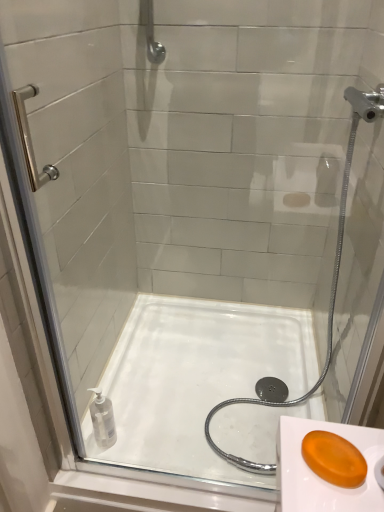
What do you see at coordinates (153, 39) in the screenshot?
I see `brushed metal shower handle at upper center` at bounding box center [153, 39].

In order to click on orange translucent soap at lower right in this screenshot , I will do `click(334, 459)`.

Is white glossy bath at center at the right side of brushed metal shower handle at upper center?

Yes, white glossy bath at center is to the right of brushed metal shower handle at upper center.

The image size is (384, 512). Identify the location of bath in front of the brushed metal shower handle at upper center. (195, 379).

Consider the image. Can you confirm if white glossy bath at center is taller than brushed metal shower handle at upper center?

No.

Looking at the image, does white glossy bath at center seem bigger or smaller compared to brushed metal shower handle at upper center?

Clearly, white glossy bath at center is larger in size than brushed metal shower handle at upper center.

In the scene shown: Is transparent plastic bottle at lower left located outside white glossy bath at center?

Yes, transparent plastic bottle at lower left is located beyond the bounds of white glossy bath at center.

Looking at this image, is transparent plastic bottle at lower left in contact with white glossy bath at center?

transparent plastic bottle at lower left is not next to white glossy bath at center, and they're not touching.

Considering the positions of points (96, 436) and (311, 350), is point (96, 436) farther from camera compared to point (311, 350)?

No, (96, 436) is closer to viewer.

Where is `bath above the transparent plastic bottle at lower left (from the image's perspective)`? Image resolution: width=384 pixels, height=512 pixels. bath above the transparent plastic bottle at lower left (from the image's perspective) is located at coordinates (195, 379).

Locate an element on the screen. The width and height of the screenshot is (384, 512). bottle below the brushed metal shower handle at upper center (from a real-world perspective) is located at coordinates (102, 420).

Does brushed metal shower handle at upper center appear on the right side of transparent plastic bottle at lower left?

Indeed, brushed metal shower handle at upper center is positioned on the right side of transparent plastic bottle at lower left.

Is brushed metal shower handle at upper center beside transparent plastic bottle at lower left?

brushed metal shower handle at upper center and transparent plastic bottle at lower left are not in contact.

Which object is thinner, brushed metal shower handle at upper center or transparent plastic bottle at lower left?

brushed metal shower handle at upper center is thinner.

From a real-world perspective, is transparent plastic bottle at lower left physically located above or below brushed metal shower handle at upper center?

Clearly, from a real-world perspective, transparent plastic bottle at lower left is below brushed metal shower handle at upper center.

Considering the relative positions of transparent plastic bottle at lower left and brushed metal shower handle at upper center in the image provided, is transparent plastic bottle at lower left to the right of brushed metal shower handle at upper center from the viewer's perspective?

In fact, transparent plastic bottle at lower left is to the left of brushed metal shower handle at upper center.

Is the position of transparent plastic bottle at lower left less distant than that of brushed metal shower handle at upper center?

Yes, it is in front of brushed metal shower handle at upper center.

Is transparent plastic bottle at lower left not inside brushed metal shower handle at upper center?

Yes, transparent plastic bottle at lower left is not within brushed metal shower handle at upper center.

Is white glossy bath at center completely or partially inside orange translucent soap at lower right?

No.

Does orange translucent soap at lower right lie in front of white glossy bath at center?

Yes, orange translucent soap at lower right is in front of white glossy bath at center.

Considering the sizes of objects orange translucent soap at lower right and white glossy bath at center in the image provided, who is bigger, orange translucent soap at lower right or white glossy bath at center?

Bigger between the two is white glossy bath at center.

From a real-world perspective, is orange translucent soap at lower right positioned above or below white glossy bath at center?

From a real-world perspective, orange translucent soap at lower right is physically above white glossy bath at center.

Between brushed metal shower handle at upper center and orange translucent soap at lower right, which one appears on the right side from the viewer's perspective?

Positioned to the right is orange translucent soap at lower right.

From a real-world perspective, is brushed metal shower handle at upper center on orange translucent soap at lower right?

Yes, from a real-world perspective, brushed metal shower handle at upper center is above orange translucent soap at lower right.

Between brushed metal shower handle at upper center and orange translucent soap at lower right, which one has less height?

orange translucent soap at lower right.

Are brushed metal shower handle at upper center and orange translucent soap at lower right located far from each other?

brushed metal shower handle at upper center is positioned a significant distance from orange translucent soap at lower right.

Looking at this image, is transparent plastic bottle at lower left a part of white glossy bath at center?

No, transparent plastic bottle at lower left is located outside of white glossy bath at center.

Is white glossy bath at center far away from transparent plastic bottle at lower left?

They are positioned close to each other.

Does white glossy bath at center have a smaller size compared to transparent plastic bottle at lower left?

Incorrect, white glossy bath at center is not smaller in size than transparent plastic bottle at lower left.

Can you confirm if white glossy bath at center is taller than transparent plastic bottle at lower left?

Incorrect, the height of white glossy bath at center is not larger of that of transparent plastic bottle at lower left.

Where is `shower positioned vertically above the white glossy bath at center (from a real-world perspective)`? shower positioned vertically above the white glossy bath at center (from a real-world perspective) is located at coordinates (153, 39).

The image size is (384, 512). What are the coordinates of `bath that appears in front of the transparent plastic bottle at lower left` in the screenshot? It's located at (195, 379).

Based on their spatial positions, is brushed metal shower handle at upper center or orange translucent soap at lower right closer to transparent plastic bottle at lower left?

Among the two, orange translucent soap at lower right is located nearer to transparent plastic bottle at lower left.

When comparing their distances from white glossy bath at center, does transparent plastic bottle at lower left or brushed metal shower handle at upper center seem closer?

The object closer to white glossy bath at center is transparent plastic bottle at lower left.

From the image, which object appears to be farther from white glossy bath at center, orange translucent soap at lower right or brushed metal shower handle at upper center?

brushed metal shower handle at upper center lies further to white glossy bath at center than the other object.

Looking at the image, which one is located further to white glossy bath at center, brushed metal shower handle at upper center or transparent plastic bottle at lower left?

brushed metal shower handle at upper center is positioned further to the anchor white glossy bath at center.

Estimate the real-world distances between objects in this image. Which object is closer to orange translucent soap at lower right, transparent plastic bottle at lower left or white glossy bath at center?

Based on the image, transparent plastic bottle at lower left appears to be nearer to orange translucent soap at lower right.

Considering their positions, is orange translucent soap at lower right positioned closer to brushed metal shower handle at upper center than transparent plastic bottle at lower left?

The object closer to brushed metal shower handle at upper center is transparent plastic bottle at lower left.

Based on their spatial positions, is orange translucent soap at lower right or transparent plastic bottle at lower left further from white glossy bath at center?

orange translucent soap at lower right lies further to white glossy bath at center than the other object.

Which object lies further to the anchor point brushed metal shower handle at upper center, white glossy bath at center or transparent plastic bottle at lower left?

The object further to brushed metal shower handle at upper center is transparent plastic bottle at lower left.

At what (x,y) coordinates should I click in order to perform the action: click on soap between brushed metal shower handle at upper center and white glossy bath at center in the vertical direction. Please return your answer as a coordinate pair (x, y). The height and width of the screenshot is (512, 384). Looking at the image, I should click on (334, 459).

The height and width of the screenshot is (512, 384). I want to click on bath between brushed metal shower handle at upper center and transparent plastic bottle at lower left from top to bottom, so click(195, 379).

This screenshot has height=512, width=384. Identify the location of soap between brushed metal shower handle at upper center and transparent plastic bottle at lower left in the up-down direction. (334, 459).

Image resolution: width=384 pixels, height=512 pixels. Identify the location of bath between orange translucent soap at lower right and transparent plastic bottle at lower left from front to back. (195, 379).